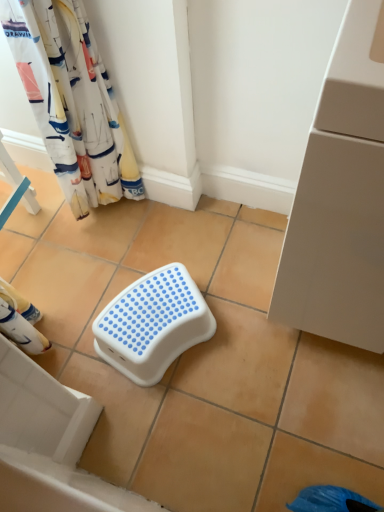
Locate an element on the screen. The height and width of the screenshot is (512, 384). free space to the left of white plastic step stool at center is located at coordinates (84, 330).